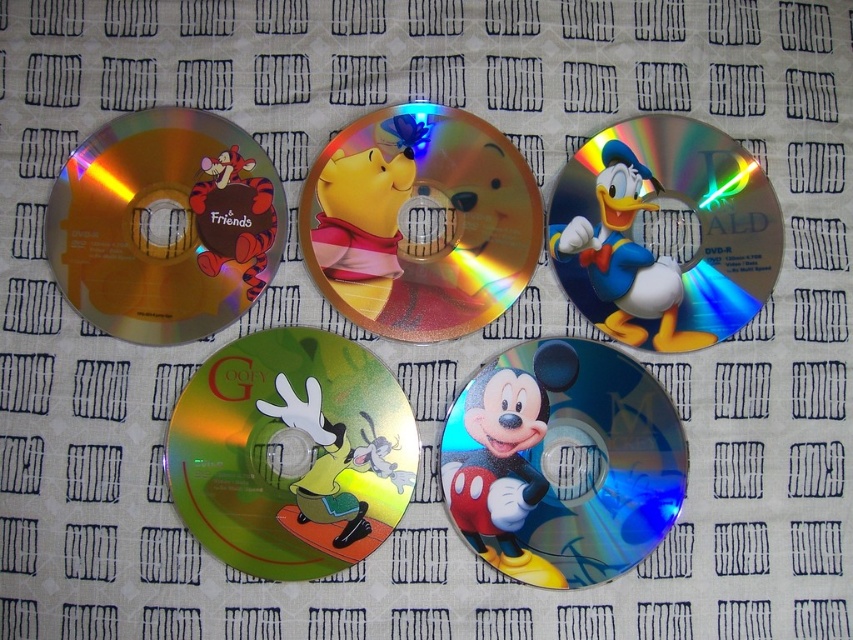
Question: Where is glossy plastic mickey mouse at center located in relation to shiny gold donald duck at upper right in the image?

Choices:
 (A) below
 (B) above

Answer: (A)

Question: From the image, what is the correct spatial relationship of gold reflective dvd at upper left in relation to shiny gold donald duck at upper right?

Choices:
 (A) right
 (B) left

Answer: (B)

Question: Which object is the farthest from the glossy plastic mickey mouse at center?

Choices:
 (A) green shiny goofy at center
 (B) glossy winnie the pooh at center
 (C) gold reflective dvd at upper left
 (D) shiny gold donald duck at upper right

Answer: (C)

Question: Which of these objects is positioned farthest from the shiny gold donald duck at upper right?

Choices:
 (A) glossy winnie the pooh at center
 (B) glossy plastic mickey mouse at center
 (C) gold reflective dvd at upper left

Answer: (C)

Question: Can you confirm if glossy winnie the pooh at center is positioned to the left of gold reflective dvd at upper left?

Choices:
 (A) no
 (B) yes

Answer: (A)

Question: Based on their relative distances, which object is farther from the shiny gold donald duck at upper right?

Choices:
 (A) glossy plastic mickey mouse at center
 (B) gold reflective dvd at upper left
 (C) glossy winnie the pooh at center

Answer: (B)